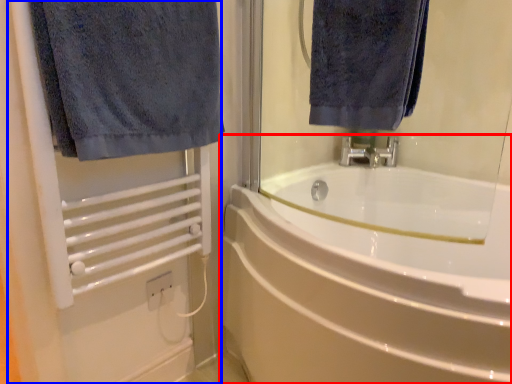
Question: Which of the following is the closest to the observer, bathtub (highlighted by a red box) or screen door (highlighted by a blue box)?

Choices:
 (A) bathtub
 (B) screen door

Answer: (A)